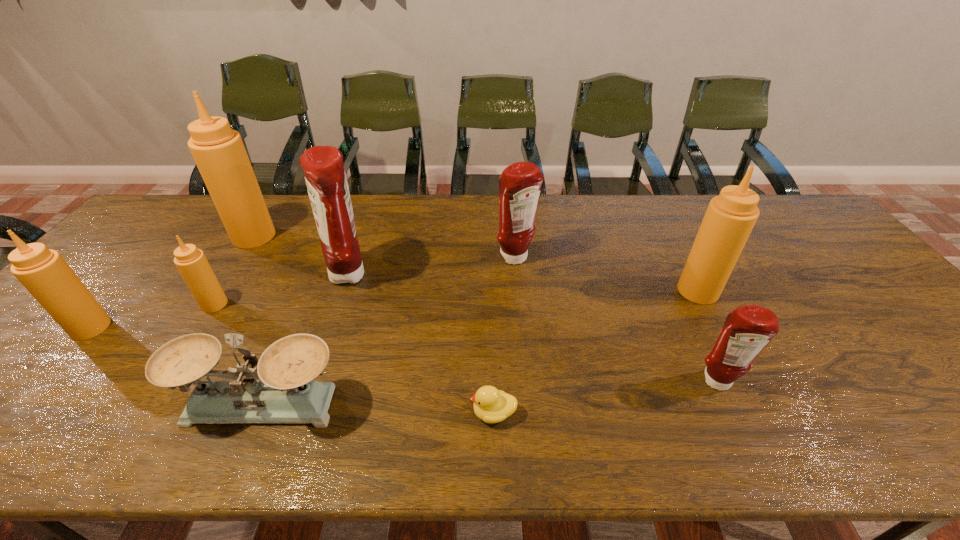
Locate an element on the screen. the farthest tan condiment is located at coordinates (218, 151).

Find the location of `the tallest condiment`. the tallest condiment is located at coordinates (218, 151).

You are a GUI agent. You are given a task and a screenshot of the screen. Output one action in this format:
    pyautogui.click(x=<x>, y=<y>)
    Task: Click on the leftmost red condiment
    The height and width of the screenshot is (540, 960).
    Given the screenshot: What is the action you would take?
    pyautogui.click(x=325, y=177)

This screenshot has height=540, width=960. What are the coordinates of `the fourth condiment from left to right` in the screenshot? It's located at (325, 177).

Locate an element on the screen. This screenshot has width=960, height=540. the rightmost tan condiment is located at coordinates (730, 217).

Find the location of a particular element. The width and height of the screenshot is (960, 540). the nearest tan condiment is located at coordinates (43, 272).

The image size is (960, 540). In order to click on the sixth farthest condiment in this screenshot , I will do `click(43, 272)`.

This screenshot has height=540, width=960. In order to click on the second red condiment from right to left in this screenshot , I will do `click(520, 183)`.

Locate an element on the screen. Image resolution: width=960 pixels, height=540 pixels. the fifth condiment from left to right is located at coordinates (520, 183).

This screenshot has width=960, height=540. I want to click on the smallest tan condiment, so click(x=191, y=262).